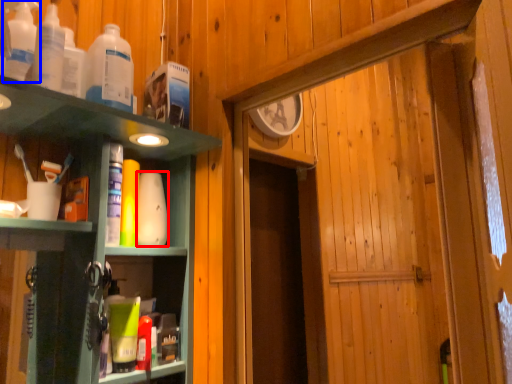
Question: Which object is closer to the camera taking this photo, toiletry (highlighted by a red box) or bottle (highlighted by a blue box)?

Choices:
 (A) toiletry
 (B) bottle

Answer: (B)